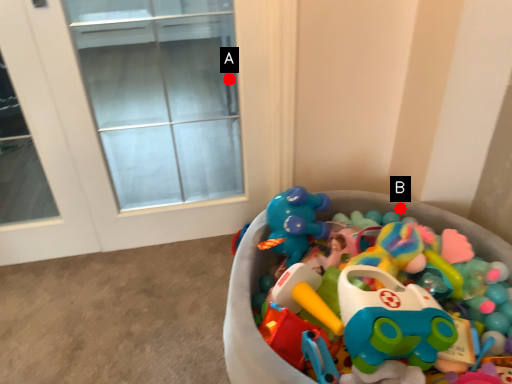
Question: Two points are circled on the image, labeled by A and B beside each circle. Among these points, which one is nearest to the camera?

Choices:
 (A) A is closer
 (B) B is closer

Answer: (B)